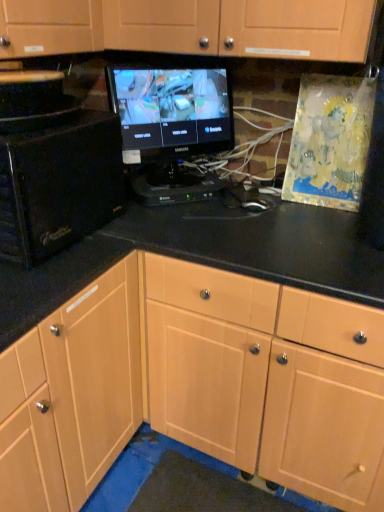
Question: Should I look upward or downward to see black glossy microwave at left?

Choices:
 (A) down
 (B) up

Answer: (B)

Question: Is light wood cabinet at center facing towards black glossy monitor at center?

Choices:
 (A) yes
 (B) no

Answer: (B)

Question: Considering the relative sizes of light wood cabinet at center and black glossy monitor at center in the image provided, is light wood cabinet at center taller than black glossy monitor at center?

Choices:
 (A) yes
 (B) no

Answer: (A)

Question: Can you see light wood cabinet at center touching black glossy monitor at center?

Choices:
 (A) yes
 (B) no

Answer: (B)

Question: Does light wood cabinet at center have a smaller size compared to black glossy monitor at center?

Choices:
 (A) no
 (B) yes

Answer: (A)

Question: Is black glossy monitor at center surrounded by light wood cabinet at center?

Choices:
 (A) no
 (B) yes

Answer: (A)

Question: Is light wood cabinet at center located outside black glossy monitor at center?

Choices:
 (A) yes
 (B) no

Answer: (A)

Question: Does black glossy monitor at center have a smaller size compared to black glossy microwave at left?

Choices:
 (A) yes
 (B) no

Answer: (A)

Question: From a real-world perspective, is black glossy monitor at center beneath black glossy microwave at left?

Choices:
 (A) no
 (B) yes

Answer: (A)

Question: Is black glossy monitor at center next to black glossy microwave at left?

Choices:
 (A) yes
 (B) no

Answer: (B)

Question: Considering the relative positions of black glossy monitor at center and black glossy microwave at left in the image provided, is black glossy monitor at center to the left of black glossy microwave at left from the viewer's perspective?

Choices:
 (A) no
 (B) yes

Answer: (A)

Question: Does black glossy monitor at center have a larger size compared to black glossy microwave at left?

Choices:
 (A) yes
 (B) no

Answer: (B)

Question: Is black glossy monitor at center behind black glossy microwave at left?

Choices:
 (A) yes
 (B) no

Answer: (A)

Question: Is light wood cabinet at center not inside black glossy microwave at left?

Choices:
 (A) no
 (B) yes

Answer: (B)